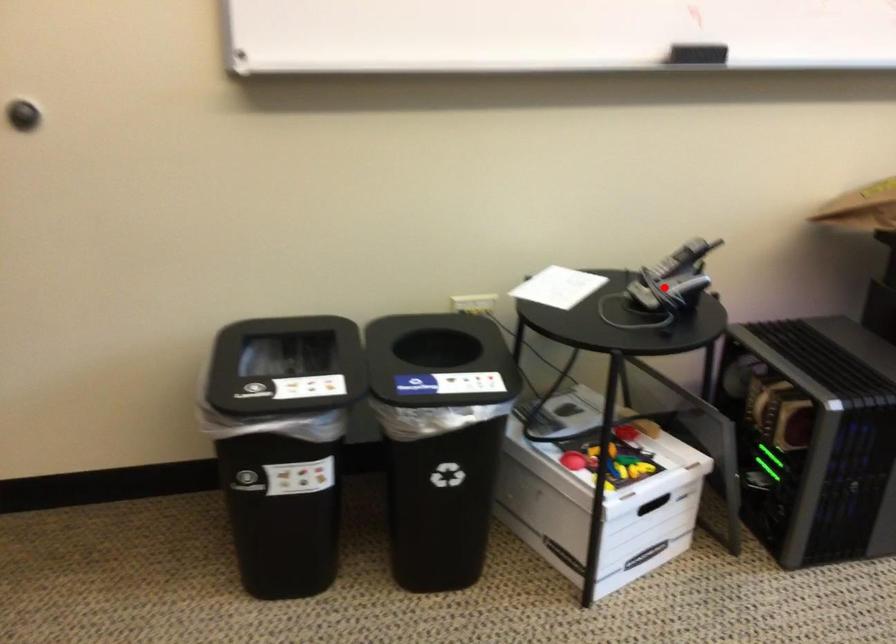
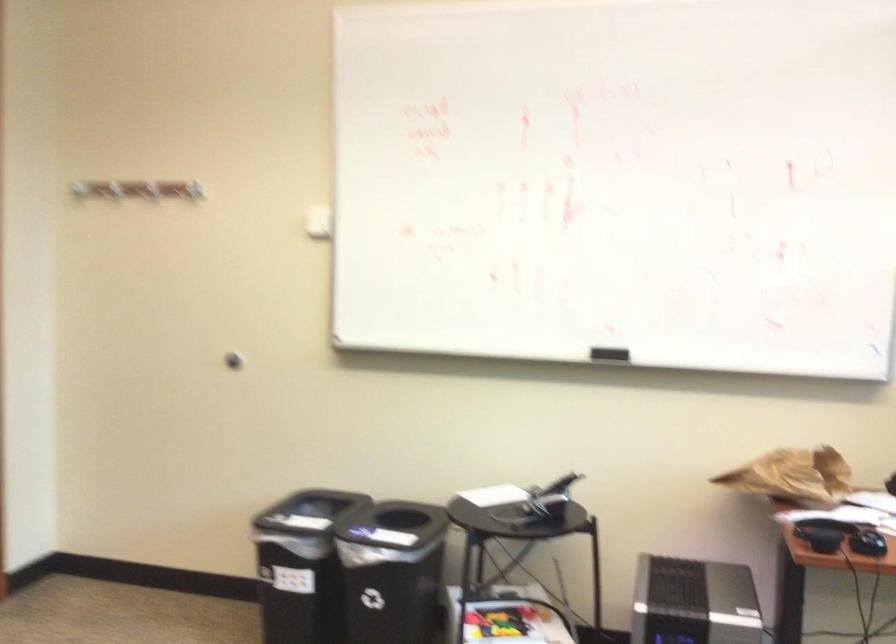
Find the pixel in the second image that matches the highlighted location in the first image.

(539, 503)